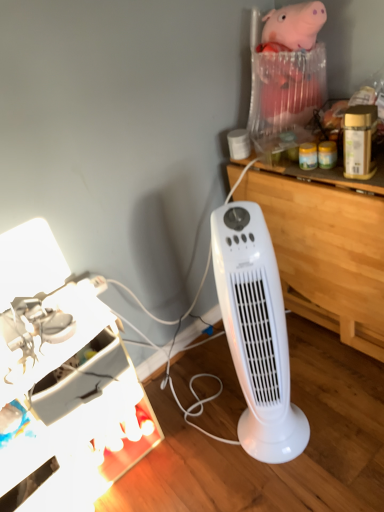
Where is `vacant space to the right of white plastic tower fan at center`? The height and width of the screenshot is (512, 384). vacant space to the right of white plastic tower fan at center is located at coordinates (335, 415).